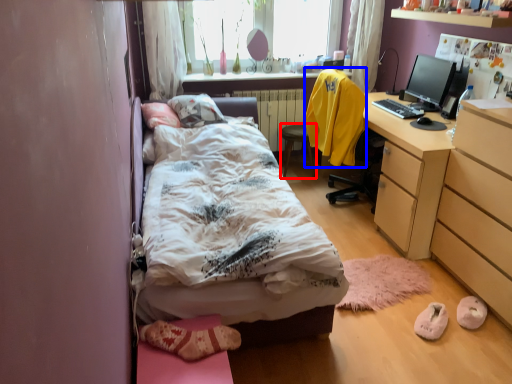
Question: Which of the following is the farthest to the observer, chair (highlighted by a red box) or sweatshirt (highlighted by a blue box)?

Choices:
 (A) chair
 (B) sweatshirt

Answer: (A)